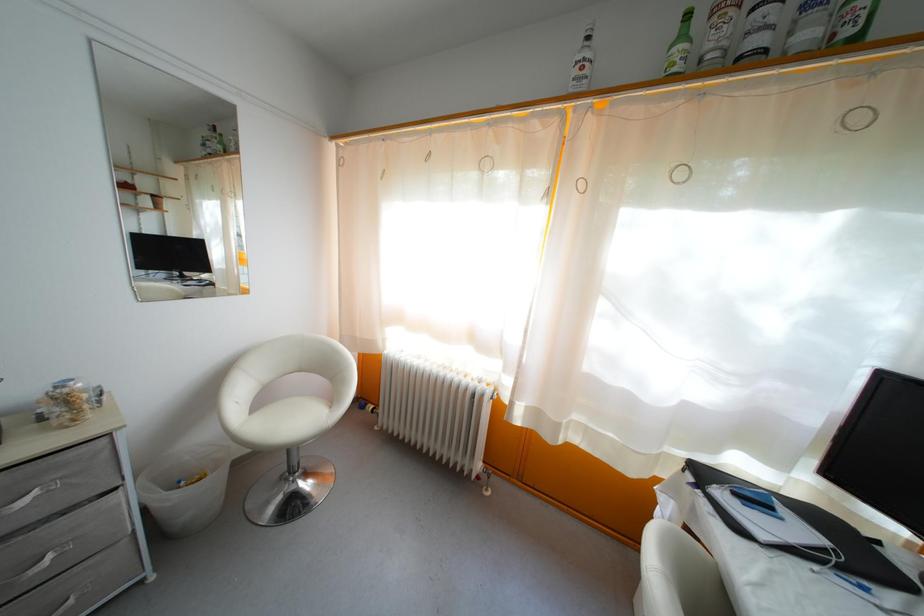
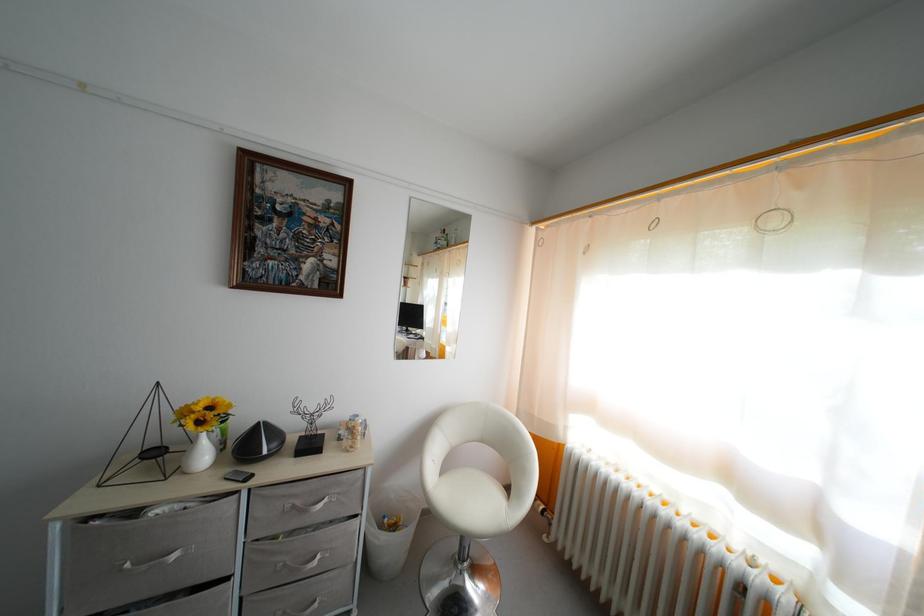
Question: The camera is either moving clockwise (left) or counter-clockwise (right) around the object. The first image is from the beginning of the video and the second image is from the end. Is the camera moving left or right when shooting the video?

Choices:
 (A) Left
 (B) Right

Answer: (B)